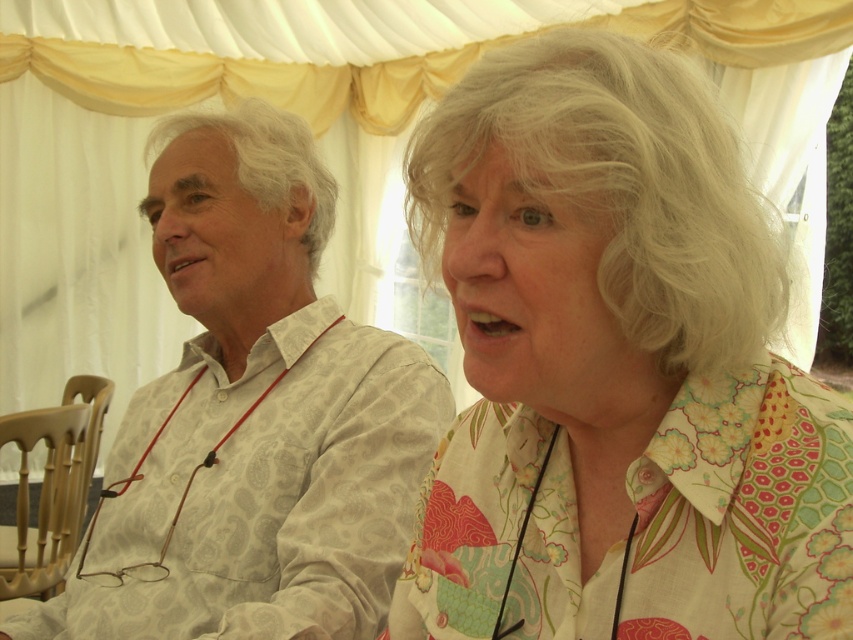
Does floral cotton blouse at upper right appear under white paisley shirt at left?

Indeed, floral cotton blouse at upper right is positioned under white paisley shirt at left.

Is point (466, 172) in front of point (260, 436)?

Yes, point (466, 172) is closer to viewer.

Identify the location of floral cotton blouse at upper right. (616, 369).